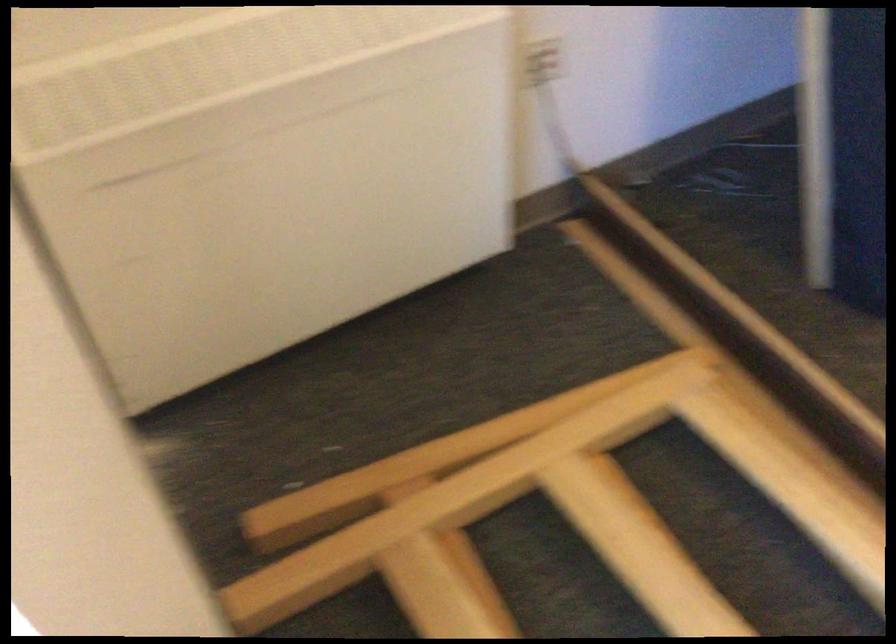
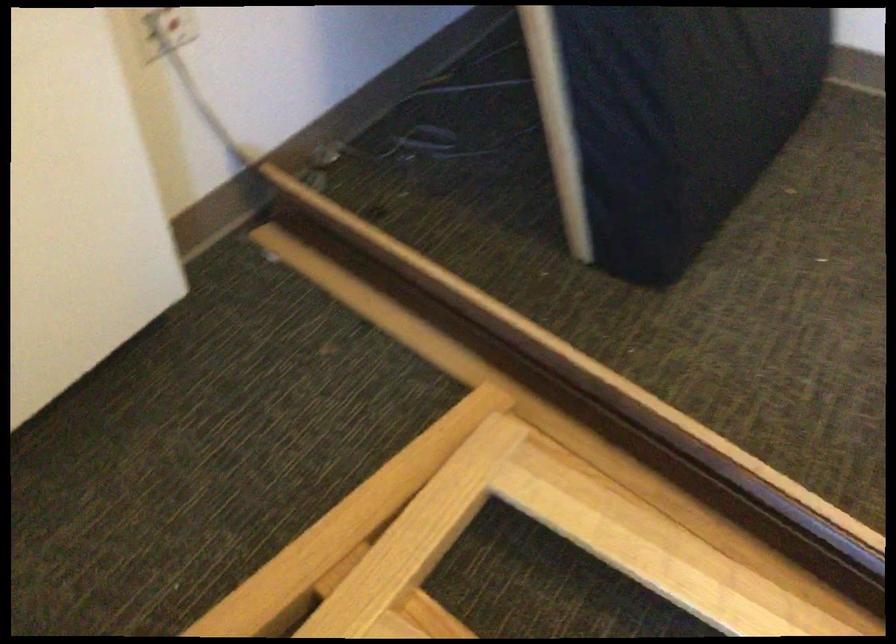
Question: The camera is either moving clockwise (left) or counter-clockwise (right) around the object. The first image is from the beginning of the video and the second image is from the end. Is the camera moving left or right when shooting the video?

Choices:
 (A) Left
 (B) Right

Answer: (A)